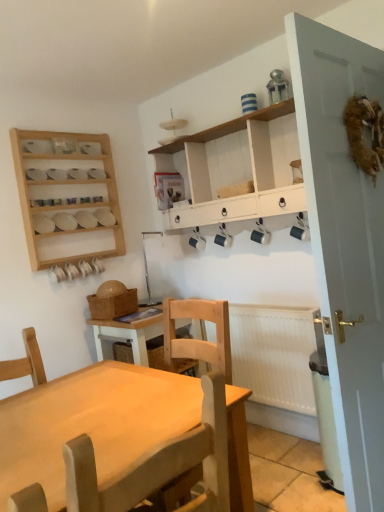
Question: Does white painted wood cabinet at upper center have a lesser width compared to white matte radiator at lower right?

Choices:
 (A) no
 (B) yes

Answer: (A)

Question: From the image's perspective, is white painted wood cabinet at upper center beneath white matte radiator at lower right?

Choices:
 (A) yes
 (B) no

Answer: (B)

Question: Can you confirm if white painted wood cabinet at upper center is smaller than white matte radiator at lower right?

Choices:
 (A) no
 (B) yes

Answer: (A)

Question: Is white painted wood cabinet at upper center not close to white matte radiator at lower right?

Choices:
 (A) yes
 (B) no

Answer: (B)

Question: Can you confirm if white painted wood cabinet at upper center is wider than white matte radiator at lower right?

Choices:
 (A) no
 (B) yes

Answer: (B)

Question: Is white painted wood cabinet at upper center not within white matte radiator at lower right?

Choices:
 (A) no
 (B) yes

Answer: (B)

Question: Can you confirm if white painted wood cabinet at upper center is positioned to the right of wooden spice rack at upper left?

Choices:
 (A) no
 (B) yes

Answer: (B)

Question: Is white painted wood cabinet at upper center placed right next to wooden spice rack at upper left?

Choices:
 (A) no
 (B) yes

Answer: (A)

Question: Does white painted wood cabinet at upper center have a larger size compared to wooden spice rack at upper left?

Choices:
 (A) no
 (B) yes

Answer: (B)

Question: From the image's perspective, is white painted wood cabinet at upper center over wooden spice rack at upper left?

Choices:
 (A) no
 (B) yes

Answer: (B)

Question: Can you confirm if white painted wood cabinet at upper center is taller than wooden spice rack at upper left?

Choices:
 (A) no
 (B) yes

Answer: (A)

Question: Is white painted wood cabinet at upper center shorter than wooden spice rack at upper left?

Choices:
 (A) yes
 (B) no

Answer: (A)

Question: From the image's perspective, is white painted door at right on light brown wooden chair at center?

Choices:
 (A) no
 (B) yes

Answer: (B)